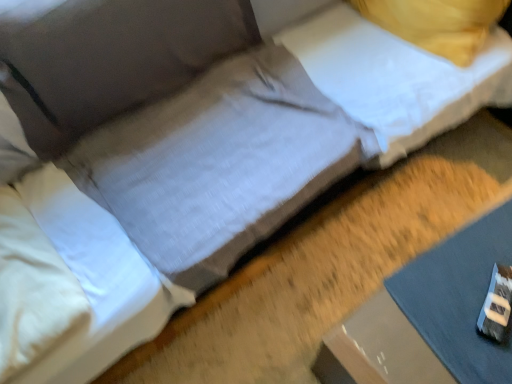
Question: Are gray fabric sheet at lower right and white soft pillow at left, the second pillow from the top, located far from each other?

Choices:
 (A) yes
 (B) no

Answer: (B)

Question: From a real-world perspective, does gray fabric sheet at lower right stand above white soft pillow at left, the second pillow when ordered from back to front?

Choices:
 (A) no
 (B) yes

Answer: (A)

Question: Are gray fabric sheet at lower right and white soft pillow at left, which is the 2th pillow from right to left, making contact?

Choices:
 (A) no
 (B) yes

Answer: (A)

Question: Is gray fabric sheet at lower right further to the viewer compared to white soft pillow at left, the first pillow in the bottom-to-top sequence?

Choices:
 (A) no
 (B) yes

Answer: (B)

Question: Is white soft pillow at left, positioned as the 1th pillow in left-to-right order, at the back of gray fabric sheet at lower right?

Choices:
 (A) no
 (B) yes

Answer: (A)

Question: Does gray fabric sheet at lower right lie in front of white soft pillow at left, which is the 1th pillow in front-to-back order?

Choices:
 (A) no
 (B) yes

Answer: (A)

Question: From the image's perspective, is white soft pillow at left, the second pillow when ordered from back to front, located beneath gray fabric sheet at lower right?

Choices:
 (A) no
 (B) yes

Answer: (A)

Question: Can you confirm if white soft pillow at left, the second pillow when ordered from back to front, is positioned to the left of gray fabric sheet at lower right?

Choices:
 (A) yes
 (B) no

Answer: (A)

Question: From a real-world perspective, is white soft pillow at left, the first pillow in the bottom-to-top sequence, on gray fabric sheet at lower right?

Choices:
 (A) no
 (B) yes

Answer: (B)

Question: Is white soft pillow at left, which is the 2th pillow from right to left, looking in the opposite direction of gray fabric sheet at lower right?

Choices:
 (A) yes
 (B) no

Answer: (B)

Question: Does white soft pillow at left, the second pillow from the top, have a greater height compared to gray fabric sheet at lower right?

Choices:
 (A) no
 (B) yes

Answer: (B)

Question: Is white soft pillow at left, the second pillow when ordered from back to front, directly adjacent to gray fabric sheet at lower right?

Choices:
 (A) no
 (B) yes

Answer: (A)

Question: Is gray fabric sheet at lower right surrounded by white soft pillow at upper right, which is the 2th pillow in front-to-back order?

Choices:
 (A) no
 (B) yes

Answer: (A)